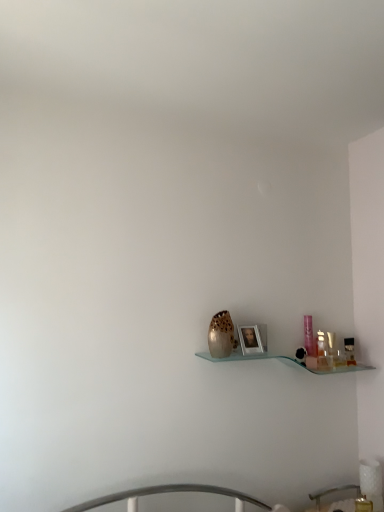
The width and height of the screenshot is (384, 512). What do you see at coordinates (349, 351) in the screenshot? I see `black plastic toiletry at right, the first toiletry positioned from the right` at bounding box center [349, 351].

Locate an element on the screen. The height and width of the screenshot is (512, 384). metallic silver frame at center is located at coordinates (250, 339).

Considering the positions of objects translucent glass vase at center and translucent plastic bottle at right, the first toiletry from the left, in the image provided, who is more to the right, translucent glass vase at center or translucent plastic bottle at right, the first toiletry from the left,?

translucent plastic bottle at right, the first toiletry from the left.

From a real-world perspective, who is located lower, translucent glass vase at center or translucent plastic bottle at right, the first toiletry from the left?

In real-world perspective, translucent plastic bottle at right, the first toiletry from the left, is lower.

Can you confirm if translucent glass vase at center is wider than translucent plastic bottle at right, the first toiletry from the left?

Indeed, translucent glass vase at center has a greater width compared to translucent plastic bottle at right, the first toiletry from the left.

From a real-world perspective, which object rests below the other?

In real-world perspective, black plastic toiletry at right, the first toiletry positioned from the right, is lower.

Considering the sizes of objects translucent plastic bottle at right, the first toiletry from the left, and black plastic toiletry at right, the first toiletry positioned from the right, in the image provided, who is taller, translucent plastic bottle at right, the first toiletry from the left, or black plastic toiletry at right, the first toiletry positioned from the right,?

Standing taller between the two is translucent plastic bottle at right, the first toiletry from the left.

Is translucent plastic bottle at right, the 2th toiletry positioned from the right, touching black plastic toiletry at right, the first toiletry positioned from the right?

No, translucent plastic bottle at right, the 2th toiletry positioned from the right, is not making contact with black plastic toiletry at right, the first toiletry positioned from the right.

The height and width of the screenshot is (512, 384). Find the location of `toiletry above the black plastic toiletry at right, the first toiletry positioned from the right (from a real-world perspective)`. toiletry above the black plastic toiletry at right, the first toiletry positioned from the right (from a real-world perspective) is located at coordinates (320, 344).

From the picture: Considering the sizes of translucent plastic bottle at right, the 2th toiletry positioned from the right, and translucent glass vase at center in the image, is translucent plastic bottle at right, the 2th toiletry positioned from the right, wider or thinner than translucent glass vase at center?

In the image, translucent plastic bottle at right, the 2th toiletry positioned from the right, appears to be more narrow than translucent glass vase at center.

Does translucent plastic bottle at right, the first toiletry from the left, have a greater height compared to translucent glass vase at center?

In fact, translucent plastic bottle at right, the first toiletry from the left, may be shorter than translucent glass vase at center.

Considering the relative positions of translucent plastic bottle at right, the first toiletry from the left, and translucent glass vase at center in the image provided, is translucent plastic bottle at right, the first toiletry from the left, to the left or to the right of translucent glass vase at center?

translucent plastic bottle at right, the first toiletry from the left, is positioned on translucent glass vase at center's right side.

Is translucent plastic bottle at right, the first toiletry from the left, further to camera compared to translucent glass vase at center?

Yes, translucent plastic bottle at right, the first toiletry from the left, is further from the camera.

Can you confirm if translucent plastic bottle at right, the 2th toiletry positioned from the right, is taller than metallic silver frame at center?

Yes.

Does point (318, 356) appear closer or farther from the camera than point (244, 346)?

Point (318, 356) is positioned farther from the camera compared to point (244, 346).

Is translucent plastic bottle at right, the 2th toiletry positioned from the right, not inside metallic silver frame at center?

Yes, translucent plastic bottle at right, the 2th toiletry positioned from the right, is not within metallic silver frame at center.

Is translucent plastic bottle at right, the 2th toiletry positioned from the right, to the right of metallic silver frame at center from the viewer's perspective?

Indeed, translucent plastic bottle at right, the 2th toiletry positioned from the right, is positioned on the right side of metallic silver frame at center.

You are a GUI agent. You are given a task and a screenshot of the screen. Output one action in this format:
    pyautogui.click(x=<x>, y=<y>)
    Task: Click on the 1st toiletry behind the metallic silver frame at center
    
    Given the screenshot: What is the action you would take?
    pyautogui.click(x=320, y=344)

From the picture: From a real-world perspective, is metallic silver frame at center under translucent plastic bottle at right, the 2th toiletry positioned from the right?

No, from a real-world perspective, metallic silver frame at center is not under translucent plastic bottle at right, the 2th toiletry positioned from the right.

Is metallic silver frame at center wider or thinner than translucent plastic bottle at right, the 2th toiletry positioned from the right?

Considering their sizes, metallic silver frame at center looks broader than translucent plastic bottle at right, the 2th toiletry positioned from the right.

Does metallic silver frame at center touch translucent plastic bottle at right, the 2th toiletry positioned from the right?

metallic silver frame at center and translucent plastic bottle at right, the 2th toiletry positioned from the right, are not in contact.

From the picture: Can you confirm if black plastic toiletry at right, the first toiletry positioned from the right, is thinner than metallic silver frame at center?

Correct, the width of black plastic toiletry at right, the first toiletry positioned from the right, is less than that of metallic silver frame at center.

From the image's perspective, is black plastic toiletry at right, the first toiletry positioned from the right, under metallic silver frame at center?

Indeed, from the image's perspective, black plastic toiletry at right, the first toiletry positioned from the right, is shown beneath metallic silver frame at center.

Considering the sizes of objects black plastic toiletry at right, the 2th toiletry when ordered from left to right, and metallic silver frame at center in the image provided, who is taller, black plastic toiletry at right, the 2th toiletry when ordered from left to right, or metallic silver frame at center?

metallic silver frame at center is taller.

Which point is more forward, (212, 342) or (244, 353)?

Positioned in front is point (212, 342).

Does translucent glass vase at center turn towards metallic silver frame at center?

No, translucent glass vase at center is not oriented towards metallic silver frame at center.

Which of these two, translucent glass vase at center or metallic silver frame at center, is smaller?

Smaller between the two is metallic silver frame at center.

Starting from the translucent glass vase at center, which toiletry is the 1st one to the right? Please provide its 2D coordinates.

[(320, 344)]

Where is `toiletry on the left of black plastic toiletry at right, the 2th toiletry when ordered from left to right`? toiletry on the left of black plastic toiletry at right, the 2th toiletry when ordered from left to right is located at coordinates (320, 344).

From the image, which object appears to be nearer to black plastic toiletry at right, the first toiletry positioned from the right, metallic silver frame at center or translucent glass vase at center?

metallic silver frame at center lies closer to black plastic toiletry at right, the first toiletry positioned from the right, than the other object.

Estimate the real-world distances between objects in this image. Which object is closer to translucent plastic bottle at right, the 2th toiletry positioned from the right, black plastic toiletry at right, the first toiletry positioned from the right, or translucent glass vase at center?

black plastic toiletry at right, the first toiletry positioned from the right.

When comparing their distances from translucent plastic bottle at right, the first toiletry from the left, does metallic silver frame at center or translucent glass vase at center seem further?

translucent glass vase at center.

Estimate the real-world distances between objects in this image. Which object is closer to black plastic toiletry at right, the 2th toiletry when ordered from left to right, translucent plastic bottle at right, the 2th toiletry positioned from the right, or translucent glass vase at center?

Based on the image, translucent plastic bottle at right, the 2th toiletry positioned from the right, appears to be nearer to black plastic toiletry at right, the 2th toiletry when ordered from left to right.

When comparing their distances from black plastic toiletry at right, the 2th toiletry when ordered from left to right, does translucent plastic bottle at right, the 2th toiletry positioned from the right, or metallic silver frame at center seem further?

metallic silver frame at center lies further to black plastic toiletry at right, the 2th toiletry when ordered from left to right, than the other object.

Which object lies further to the anchor point metallic silver frame at center, translucent glass vase at center or translucent plastic bottle at right, the 2th toiletry positioned from the right?

Based on the image, translucent plastic bottle at right, the 2th toiletry positioned from the right, appears to be further to metallic silver frame at center.

Based on the photo, considering their positions, is metallic silver frame at center positioned further to translucent glass vase at center than black plastic toiletry at right, the first toiletry positioned from the right?

black plastic toiletry at right, the first toiletry positioned from the right, lies further to translucent glass vase at center than the other object.

Estimate the real-world distances between objects in this image. Which object is closer to translucent glass vase at center, black plastic toiletry at right, the first toiletry positioned from the right, or metallic silver frame at center?

metallic silver frame at center is closer to translucent glass vase at center.

You are a GUI agent. You are given a task and a screenshot of the screen. Output one action in this format:
    pyautogui.click(x=<x>, y=<y>)
    Task: Click on the picture frame situated between translucent glass vase at center and black plastic toiletry at right, the first toiletry positioned from the right, from left to right
    Image resolution: width=384 pixels, height=512 pixels.
    Given the screenshot: What is the action you would take?
    pyautogui.click(x=250, y=339)

You are a GUI agent. You are given a task and a screenshot of the screen. Output one action in this format:
    pyautogui.click(x=<x>, y=<y>)
    Task: Click on the toiletry between translucent glass vase at center and black plastic toiletry at right, the 2th toiletry when ordered from left to right, from left to right
    
    Given the screenshot: What is the action you would take?
    pyautogui.click(x=320, y=344)

Where is `toiletry between metallic silver frame at center and black plastic toiletry at right, the 2th toiletry when ordered from left to right`? This screenshot has width=384, height=512. toiletry between metallic silver frame at center and black plastic toiletry at right, the 2th toiletry when ordered from left to right is located at coordinates (320, 344).

Identify the location of picture frame between translucent glass vase at center and translucent plastic bottle at right, the 2th toiletry positioned from the right, in the horizontal direction. (250, 339).